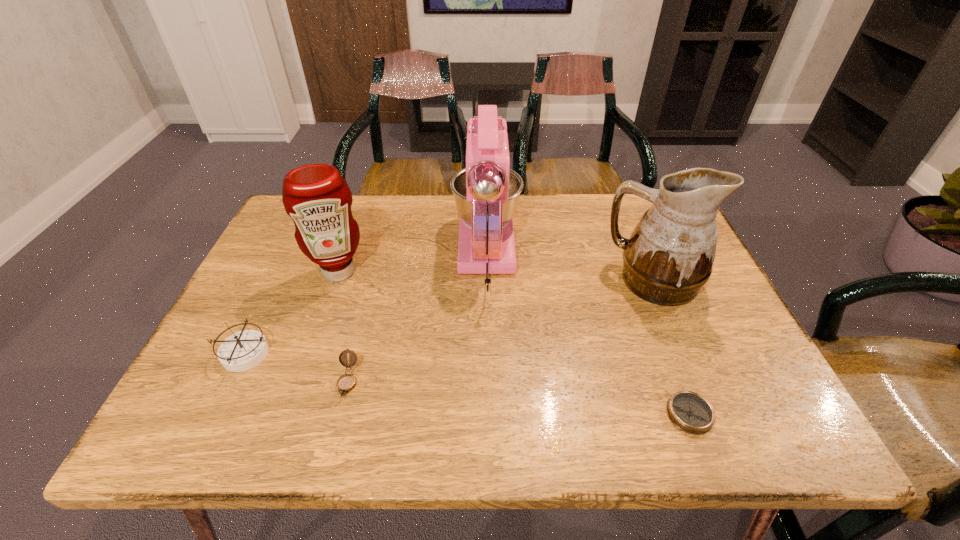
Identify the location of blank region between the pitcher and the mixer. The width and height of the screenshot is (960, 540). tap(570, 267).

Find the location of a particular element. vacant space that is in between the fifth tallest object and the condiment is located at coordinates pos(343,327).

The width and height of the screenshot is (960, 540). In order to click on free space that is in between the tallest compass and the second object from left to right in this screenshot , I will do `click(291, 313)`.

The height and width of the screenshot is (540, 960). Identify the location of free point between the shortest object and the pitcher. (671, 347).

Identify the location of free space between the fifth tallest object and the mixer. The image size is (960, 540). point(418,318).

Locate an element on the screen. The width and height of the screenshot is (960, 540). vacant area that lies between the third object from right to left and the third object from left to right is located at coordinates (418, 318).

At what (x,y) coordinates should I click in order to perform the action: click on vacant area that lies between the mixer and the shortest compass. Please return your answer as a coordinate pair (x, y). Looking at the image, I should click on (588, 334).

At what (x,y) coordinates should I click in order to perform the action: click on free space between the fourth object from left to right and the leftmost object. Please return your answer as a coordinate pair (x, y). This screenshot has height=540, width=960. Looking at the image, I should click on (366, 304).

The height and width of the screenshot is (540, 960). Find the location of `empty space between the rightmost compass and the condiment`. empty space between the rightmost compass and the condiment is located at coordinates (514, 343).

Identify which object is the fifth closest to the condiment. Please provide its 2D coordinates. Your answer should be formatted as a tuple, i.e. [(x, y)], where the tuple contains the x and y coordinates of a point satisfying the conditions above.

[(690, 412)]